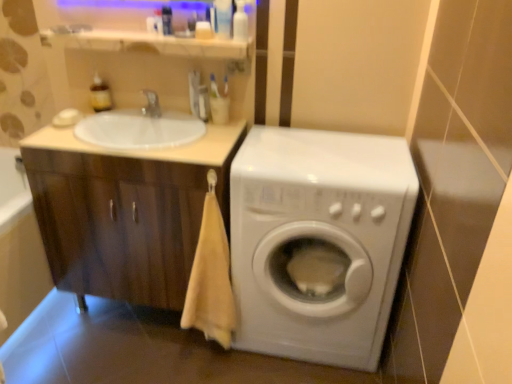
The height and width of the screenshot is (384, 512). Identify the location of free space in front of translucent amber bottle at upper left, arranged as the sixth toiletry when viewed from the right. (92, 123).